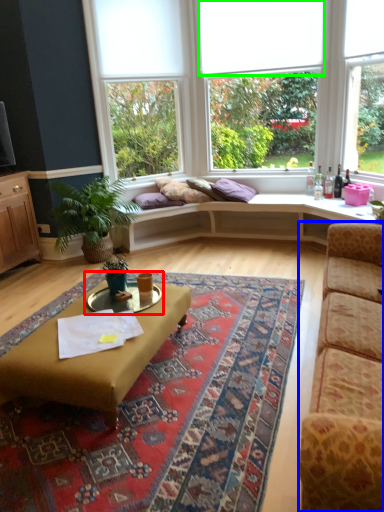
Question: Which is nearer to the cocktail table (highlighted by a red box)? studio couch (highlighted by a blue box) or blind (highlighted by a green box).

Choices:
 (A) studio couch
 (B) blind

Answer: (A)